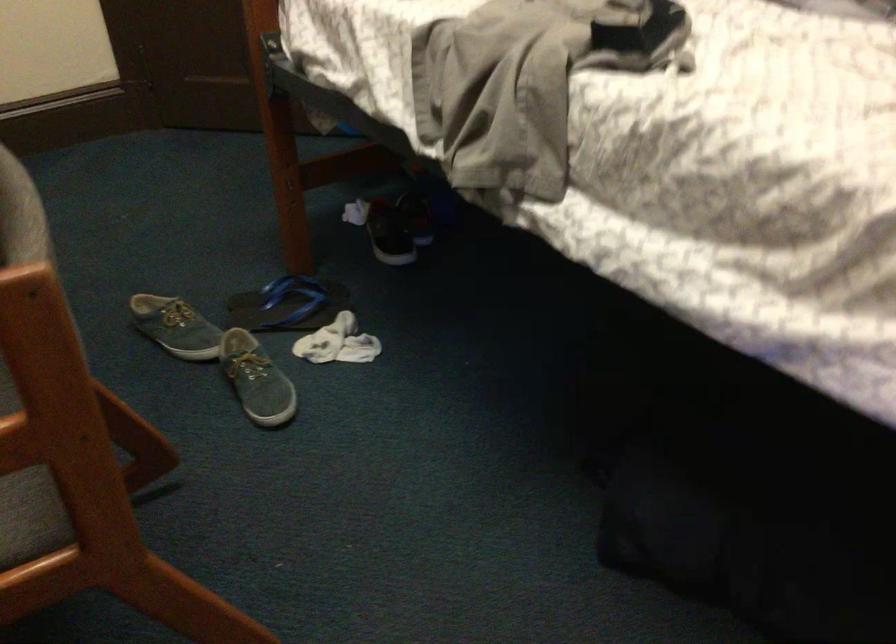
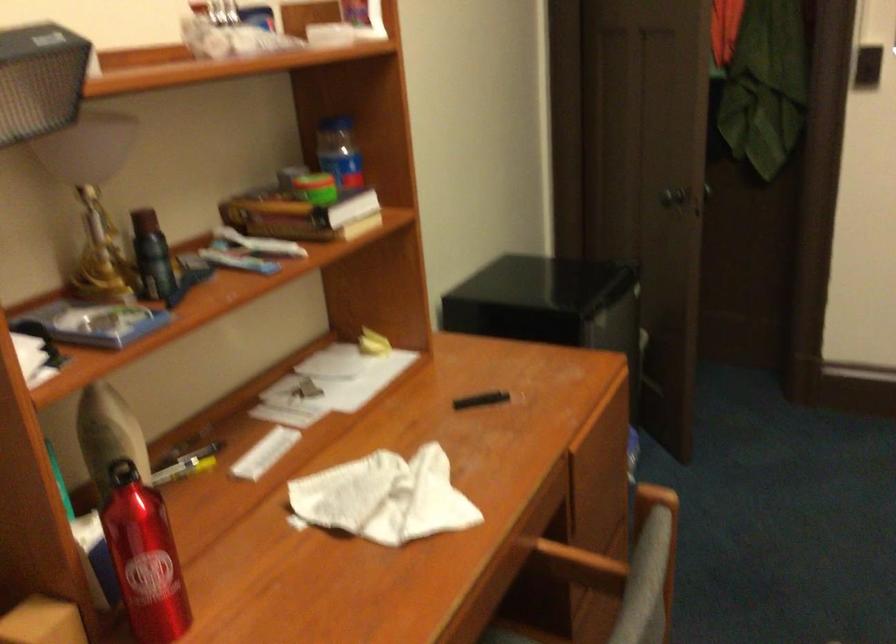
Question: The first image is from the beginning of the video and the second image is from the end. How did the camera likely rotate when shooting the video?

Choices:
 (A) Left
 (B) Right
 (C) Up
 (D) Down

Answer: (A)